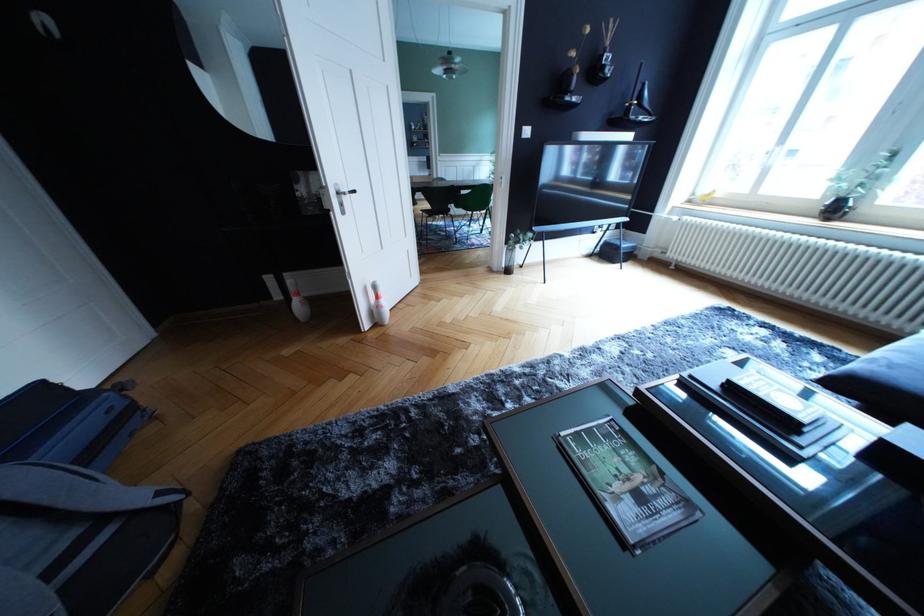
Where is `stack of books`? The width and height of the screenshot is (924, 616). stack of books is located at coordinates (764, 407).